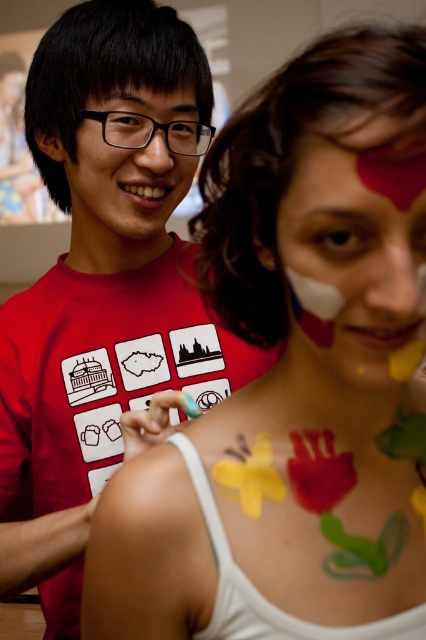
Question: Which point appears farthest from the camera in this image?

Choices:
 (A) (316, 280)
 (B) (54, 128)

Answer: (B)

Question: Is matte red paint at center to the left of matte black face at center from the viewer's perspective?

Choices:
 (A) no
 (B) yes

Answer: (A)

Question: Among these points, which one is farthest from the camera?

Choices:
 (A) (305, 243)
 (B) (91, 211)
 (C) (39, 76)

Answer: (B)

Question: Is matte red paint at center to the right of matte black face at center from the viewer's perspective?

Choices:
 (A) yes
 (B) no

Answer: (A)

Question: Which of the following is the closest to the observer?

Choices:
 (A) (34, 419)
 (B) (92, 237)

Answer: (A)

Question: Does matte red paint at center lie behind matte black face at center?

Choices:
 (A) yes
 (B) no

Answer: (B)